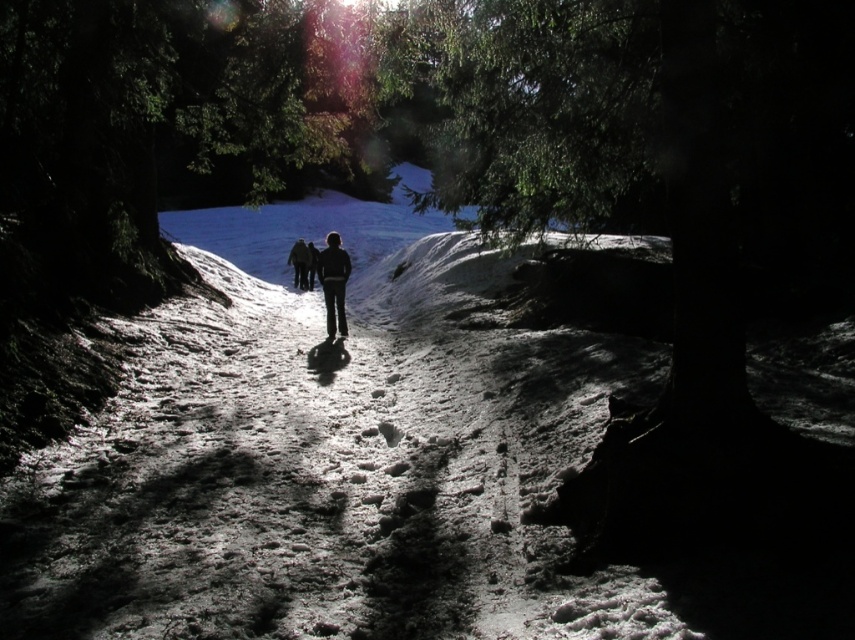
Question: Does black matte skier at center have a lesser width compared to black matte jacket at center?

Choices:
 (A) no
 (B) yes

Answer: (B)

Question: Is the position of black matte skier at center less distant than that of black matte jacket at center?

Choices:
 (A) no
 (B) yes

Answer: (B)

Question: Among these points, which one is farthest from the camera?

Choices:
 (A) (335, 324)
 (B) (293, 248)

Answer: (B)

Question: Which point is farther to the camera?

Choices:
 (A) black matte skier at center
 (B) black matte jacket at center

Answer: (B)

Question: Which point appears farthest from the camera in this image?

Choices:
 (A) (293, 266)
 (B) (331, 234)

Answer: (A)

Question: From the image, what is the correct spatial relationship of black matte skier at center in relation to black matte jacket at center?

Choices:
 (A) above
 (B) below

Answer: (B)